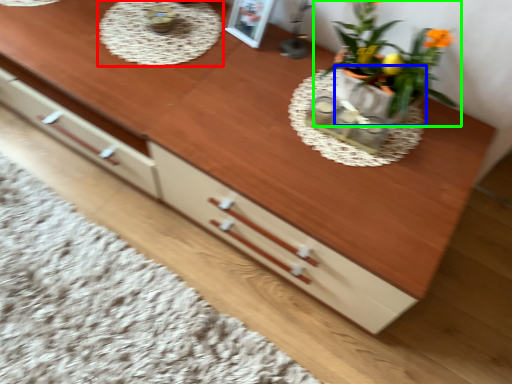
Question: Estimate the real-world distances between objects in this image. Which object is closer to round table (highlighted by a red box), flowerpot (highlighted by a blue box) or houseplant (highlighted by a green box)?

Choices:
 (A) flowerpot
 (B) houseplant

Answer: (B)